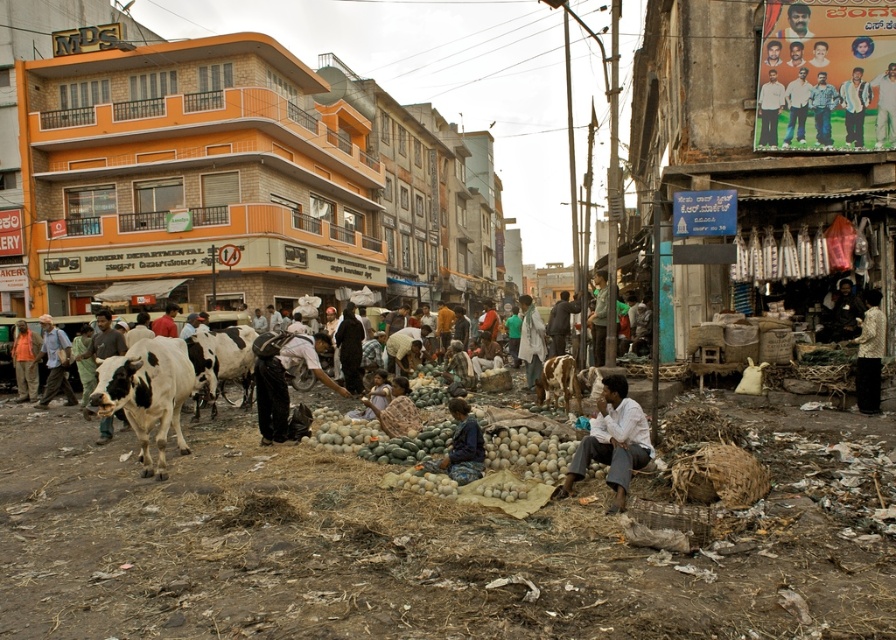
You are a photographer standing in the market area of the urban scene. You want to take a photo of the white cotton shirt at center and the white shirt at center. Which one is positioned lower in the image?

The white cotton shirt at center is located below the white shirt at center, so it is positioned lower in the image.

You are a photographer standing in the market area of the urban scene. You want to take a photo that includes both the white glossy cow at lower left and the brown textured cow at center. Which cow should you move closer to in order to include both in the frame without zooming in?

You should move closer to the white glossy cow at lower left because it is closer to the viewer than the brown textured cow at center, so adjusting your position towards it would help include both in the frame without zooming.